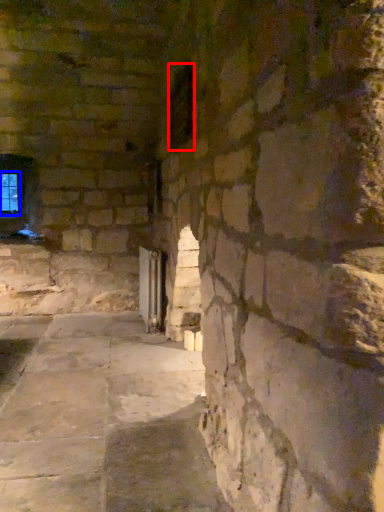
Question: Among these objects, which one is nearest to the camera, window (highlighted by a red box) or window (highlighted by a blue box)?

Choices:
 (A) window
 (B) window

Answer: (A)